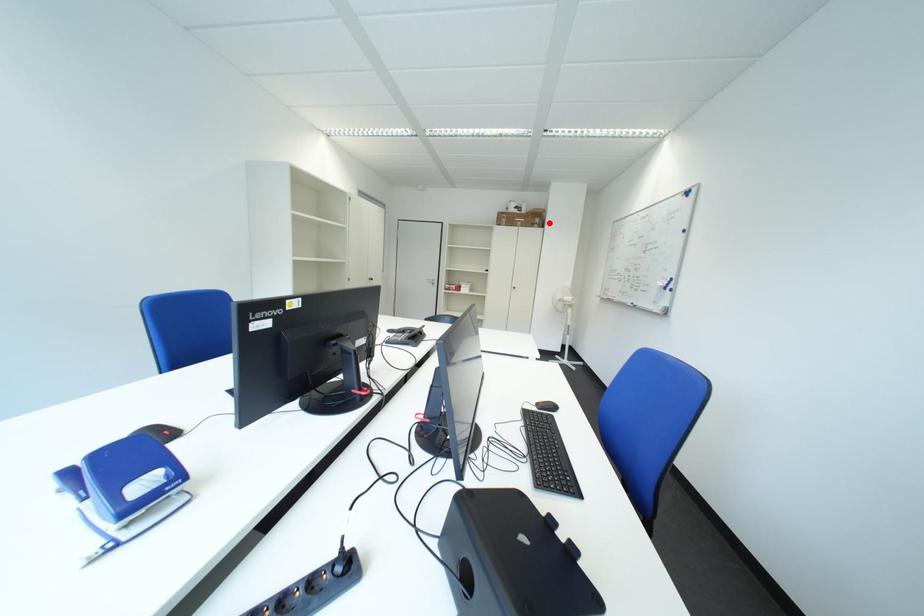
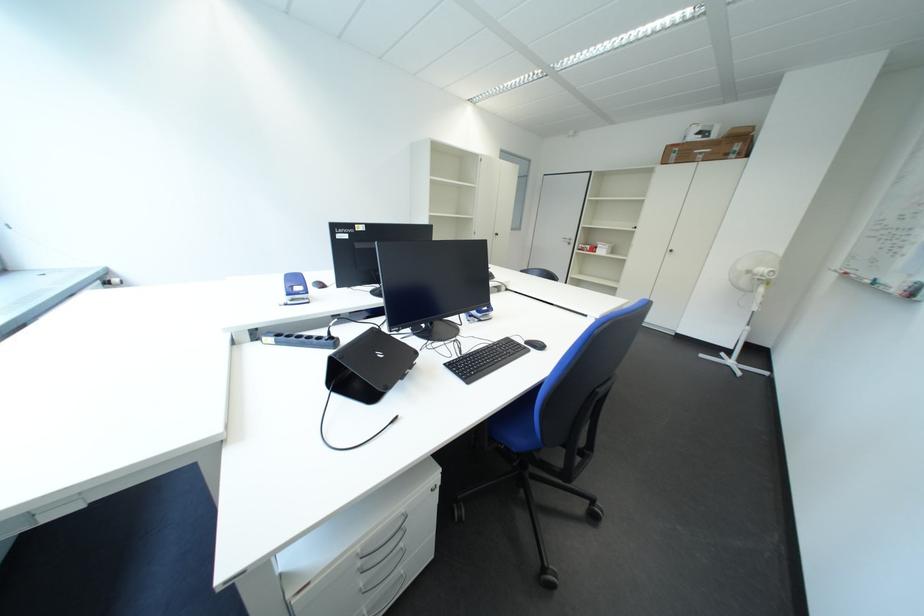
Question: I am providing you with two images of the same scene from different viewpoints. In image1, a red point is highlighted. Considering the same 3D point in image2, which of the following is correct?

Choices:
 (A) It is closer
 (B) It is farther

Answer: (B)